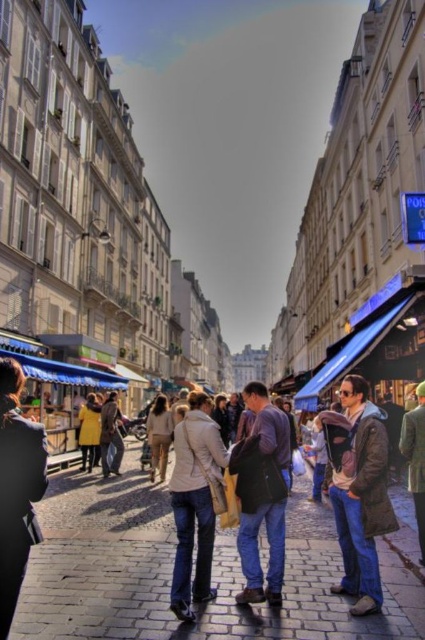
Between light beige jacket at center and yellow matte coat at lower left, which one is positioned higher?

yellow matte coat at lower left is higher up.

Is light beige jacket at center to the right of yellow matte coat at lower left from the viewer's perspective?

Indeed, light beige jacket at center is positioned on the right side of yellow matte coat at lower left.

I want to click on light beige jacket at center, so tap(195, 502).

Who is taller, denim jacket at center or dark blue jeans at center?

Standing taller between the two is dark blue jeans at center.

Describe the element at coordinates (172, 566) in the screenshot. I see `denim jacket at center` at that location.

Is point (326, 538) positioned after point (243, 490)?

Yes, point (326, 538) is behind point (243, 490).

This screenshot has height=640, width=425. I want to click on denim jacket at center, so click(x=172, y=566).

Is denim jacket at center above light beige jacket at center?

Indeed, denim jacket at center is positioned over light beige jacket at center.

Can you confirm if denim jacket at center is shorter than light beige jacket at center?

Correct, denim jacket at center is not as tall as light beige jacket at center.

Between point (373, 636) and point (209, 490), which one is positioned in front?

Positioned in front is point (373, 636).

Locate an element on the screen. The width and height of the screenshot is (425, 640). denim jacket at center is located at coordinates [x=172, y=566].